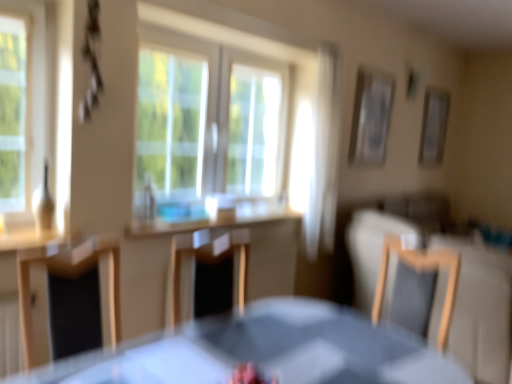
Question: Is wooden chair at center, the first chair from the left, positioned with its back to light brown wooden chair at right, the 1th chair in the right-to-left sequence?

Choices:
 (A) no
 (B) yes

Answer: (A)

Question: Does wooden chair at center, the first chair from the left, have a larger size compared to light brown wooden chair at right, the 1th chair in the right-to-left sequence?

Choices:
 (A) no
 (B) yes

Answer: (B)

Question: Does wooden chair at center, the first chair from the left, have a lesser height compared to light brown wooden chair at right, the 1th chair in the right-to-left sequence?

Choices:
 (A) no
 (B) yes

Answer: (A)

Question: Does wooden chair at center, the first chair from the left, turn towards light brown wooden chair at right, acting as the second chair starting from the left?

Choices:
 (A) no
 (B) yes

Answer: (A)

Question: Is wooden chair at center, the 2th chair in the right-to-left sequence, further to camera compared to light brown wooden chair at right, acting as the second chair starting from the left?

Choices:
 (A) no
 (B) yes

Answer: (A)

Question: Considering the positions of wooden chair at center, the first chair from the left, and wooden picture frame at upper right, placed as the 2th picture frame when sorted from left to right, in the image, is wooden chair at center, the first chair from the left, bigger or smaller than wooden picture frame at upper right, placed as the 2th picture frame when sorted from left to right,?

Choices:
 (A) big
 (B) small

Answer: (A)

Question: Is wooden chair at center, the first chair from the left, spatially inside wooden picture frame at upper right, placed as the 2th picture frame when sorted from left to right, or outside of it?

Choices:
 (A) outside
 (B) inside

Answer: (A)

Question: Considering the positions of wooden chair at center, the first chair from the left, and wooden picture frame at upper right, placed as the 2th picture frame when sorted from left to right, in the image, is wooden chair at center, the first chair from the left, wider or thinner than wooden picture frame at upper right, placed as the 2th picture frame when sorted from left to right,?

Choices:
 (A) thin
 (B) wide

Answer: (B)

Question: From a real-world perspective, is wooden chair at center, the first chair from the left, above or below wooden picture frame at upper right, which is the 1th picture frame in right-to-left order?

Choices:
 (A) above
 (B) below

Answer: (B)

Question: Does point (377, 92) appear closer or farther from the camera than point (313, 258)?

Choices:
 (A) closer
 (B) farther

Answer: (B)

Question: Is metallic silver picture frame at upper right, which is the second picture frame in back-to-front order, wider or thinner than white sheer curtain at upper center?

Choices:
 (A) wide
 (B) thin

Answer: (B)

Question: Is metallic silver picture frame at upper right, the first picture frame when ordered from left to right, bigger or smaller than white sheer curtain at upper center?

Choices:
 (A) small
 (B) big

Answer: (A)

Question: Would you say metallic silver picture frame at upper right, which is the second picture frame in back-to-front order, is to the left or to the right of white sheer curtain at upper center in the picture?

Choices:
 (A) right
 (B) left

Answer: (A)

Question: From the image's perspective, is wooden chair at center, the first chair from the left, located above or below white sheer curtain at upper center?

Choices:
 (A) below
 (B) above

Answer: (A)

Question: Looking at their shapes, would you say wooden chair at center, the first chair from the left, is wider or thinner than white sheer curtain at upper center?

Choices:
 (A) wide
 (B) thin

Answer: (A)